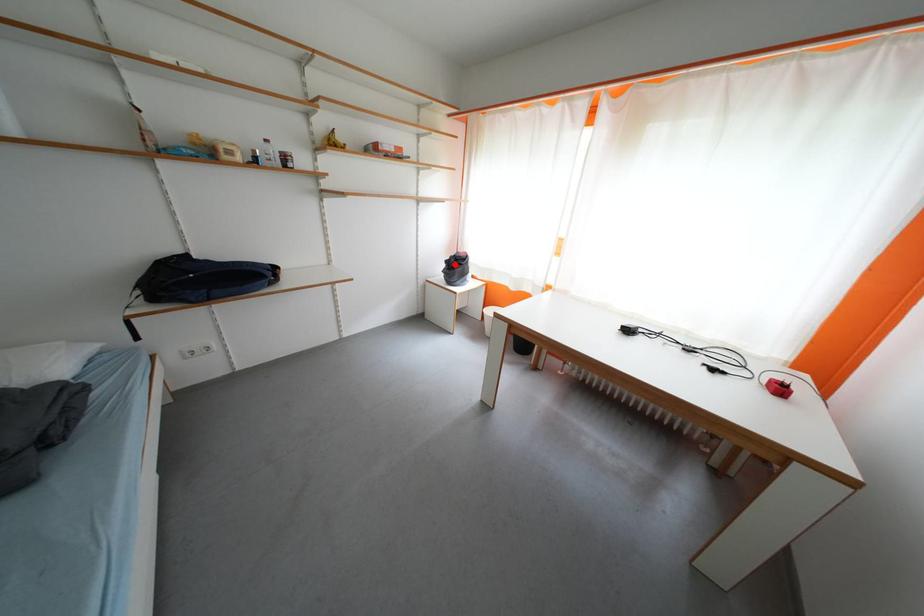
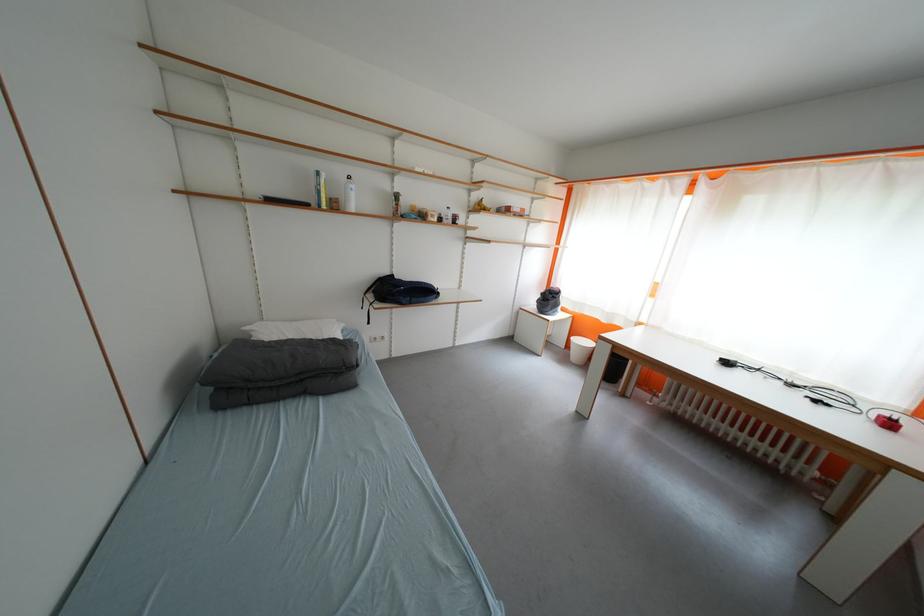
Question: I am providing you with two images of the same scene from different viewpoints. Image1 has a red point marked. In image2, the corresponding 3D location appears at what relative position? Reply with the corresponding letter.

Choices:
 (A) Closer
 (B) Farther

Answer: (A)